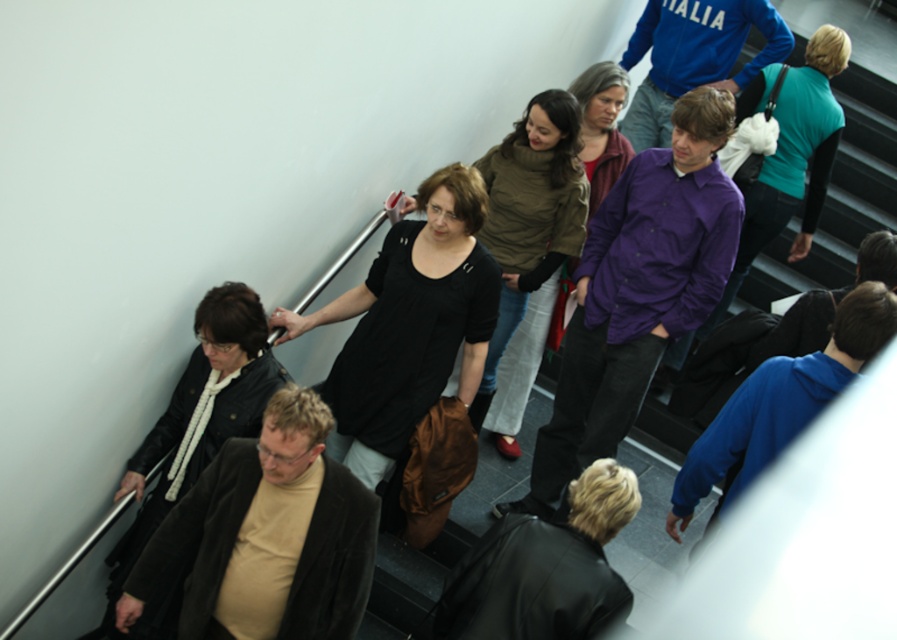
You are a photographer trying to capture a candid shot of both the black leather jacket at lower left and the black matte dress at center. Since you want to ensure both are fully visible in the frame, which object should you position closer to the camera to avoid cropping?

The black leather jacket at lower left is wider than the black matte dress at center. To ensure both are fully visible, position the black leather jacket at lower left closer to the camera since its greater width requires more space in the frame.

You are standing at the origin point of the image and want to locate the black leather jacket at lower left. Which direction should you move to reach it?

Since the black leather jacket at lower left is located at point 0.678 on the x axis and 0.221 on the y axis, you should move to the right and down from the origin to reach it.